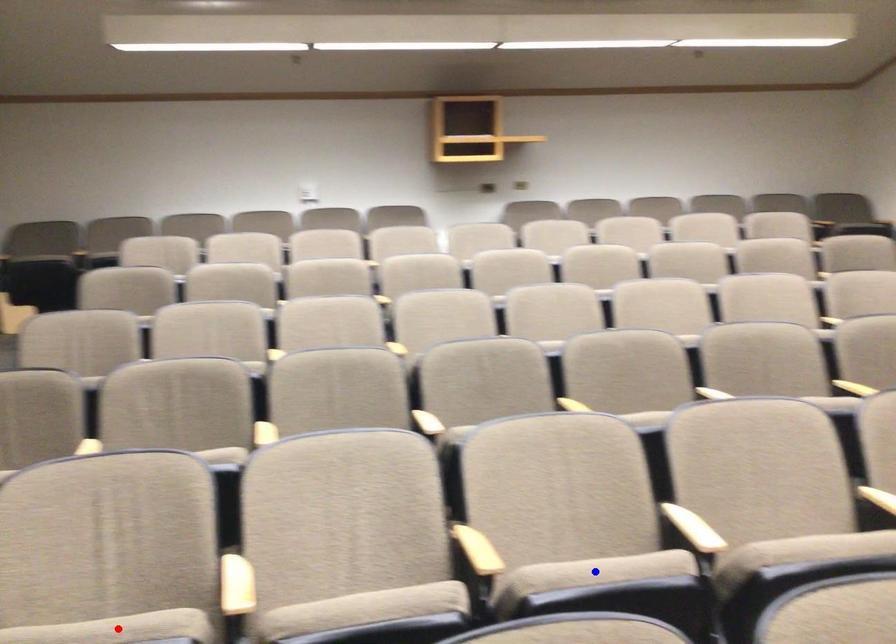
Question: Two points are marked on the image. Which point is closer to the camera?

Choices:
 (A) Blue point is closer.
 (B) Red point is closer.

Answer: (B)